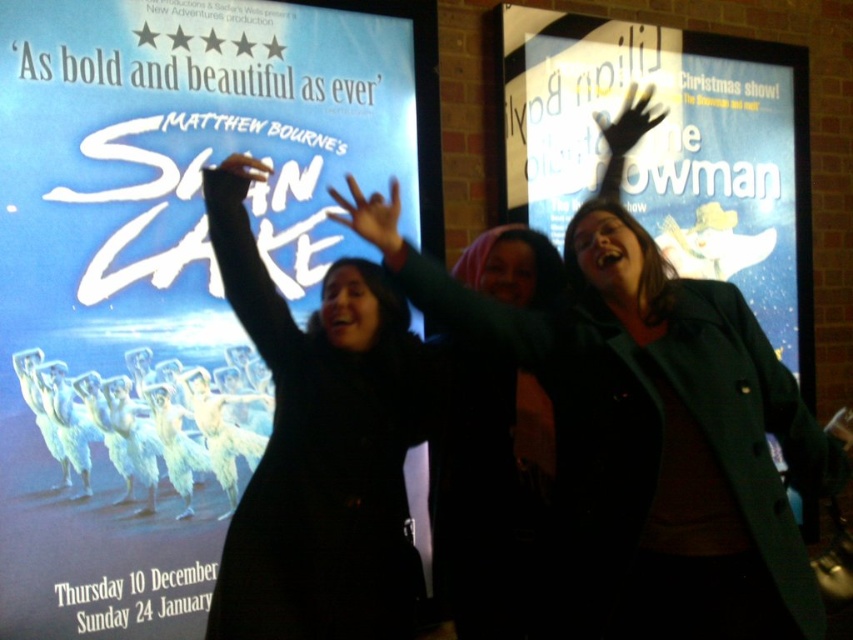
You are a painter standing 5 feet away from the matte black hand at upper center. You want to paint the matte blue snowman at upper right without moving your position. Is the snowman within your painting range?

The distance between the matte blue snowman at upper right and the matte black hand at upper center is 4.90 feet. Since you are 5 feet away from the hand, the snowman is just within your 5 feet painting range.

You are a theater enthusiast who wants to take a photo of the matte black poster at left and the teal fabric coat at center. Since you want to include both in the frame, will the poster be taller than the coat in the photo?

The matte black poster at left is much taller than the teal fabric coat at center, so yes, the poster will appear taller than the coat in the photo.

You are standing in front of the two promotional posters. There is a point at coordinates (167,273). Which poster does this point belong to?

The point at coordinates (167,273) belongs to the matte black poster at left.